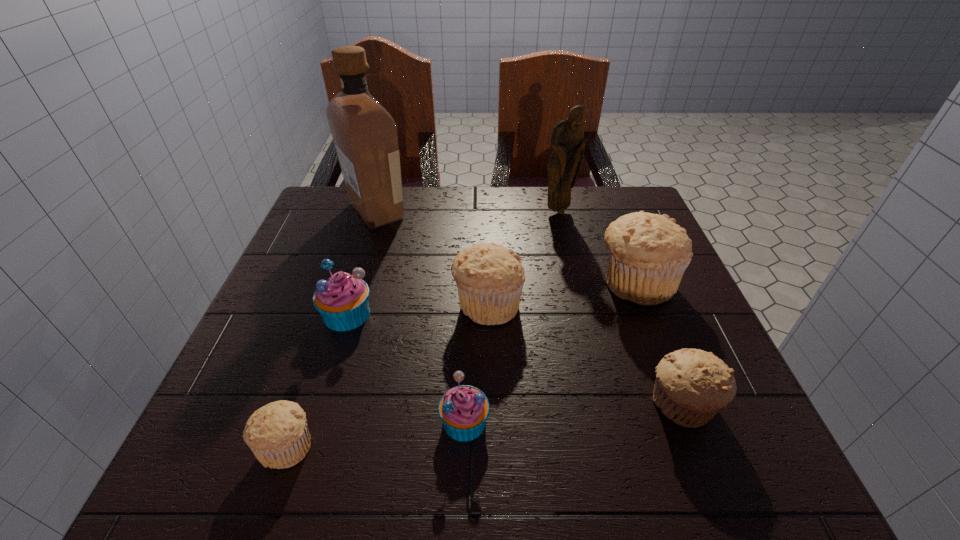
The height and width of the screenshot is (540, 960). I want to click on brown liquor, so click(x=365, y=135).

The image size is (960, 540). I want to click on the tallest object, so click(x=365, y=135).

The width and height of the screenshot is (960, 540). In order to click on the sixth object from left to right in this screenshot , I will do `click(567, 143)`.

The image size is (960, 540). What are the coordinates of `figurine` in the screenshot? It's located at 567,143.

In order to click on the biggest beige muffin in this screenshot , I will do `click(648, 253)`.

The height and width of the screenshot is (540, 960). Find the location of `the tallest muffin`. the tallest muffin is located at coordinates (648, 253).

The image size is (960, 540). Find the location of `the third beige muffin from right to left`. the third beige muffin from right to left is located at coordinates (490, 277).

The height and width of the screenshot is (540, 960). In order to click on the second tallest muffin in this screenshot , I will do `click(490, 277)`.

Where is `the bigger blue muffin`? the bigger blue muffin is located at coordinates (342, 300).

The image size is (960, 540). Identify the location of the left blue muffin. (342, 300).